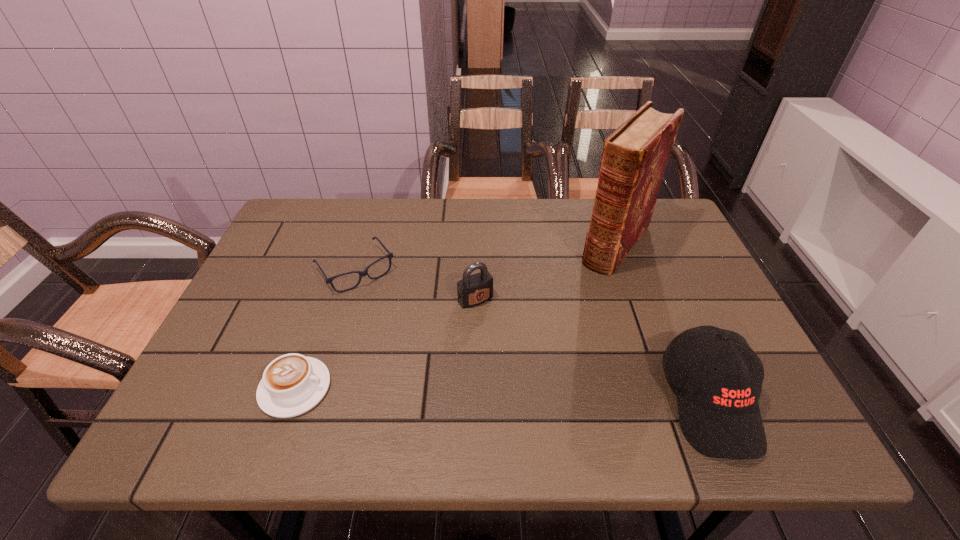
In order to click on cappuccino in this screenshot , I will do `click(292, 384)`.

At what (x,y) coordinates should I click in order to perform the action: click on baseball cap. Please return your answer as a coordinate pair (x, y). The height and width of the screenshot is (540, 960). Looking at the image, I should click on (719, 414).

The width and height of the screenshot is (960, 540). What are the coordinates of `spectacles` in the screenshot? It's located at click(x=361, y=273).

The width and height of the screenshot is (960, 540). In order to click on the third object from left to right in this screenshot , I will do `click(473, 290)`.

Find the location of a particular element. The image size is (960, 540). hardback book is located at coordinates (634, 158).

Find the location of a particular element. This screenshot has height=540, width=960. vacant area situated with the handle on the right side of the cappuccino is located at coordinates (402, 388).

What are the coordinates of `free space located 0.270m on the front-facing side of the spectacles` in the screenshot? It's located at (425, 363).

This screenshot has height=540, width=960. Find the location of `vacant space positioned 0.180m on the front-facing side of the spectacles`. vacant space positioned 0.180m on the front-facing side of the spectacles is located at coordinates (406, 337).

At what (x,y) coordinates should I click in order to perform the action: click on vacant space located on the front-facing side of the spectacles. Please return your answer as a coordinate pair (x, y). Image resolution: width=960 pixels, height=540 pixels. Looking at the image, I should click on click(432, 373).

Locate an element on the screen. Image resolution: width=960 pixels, height=540 pixels. free region located on the front of the third object from right to left near the keyhole is located at coordinates pyautogui.click(x=526, y=364).